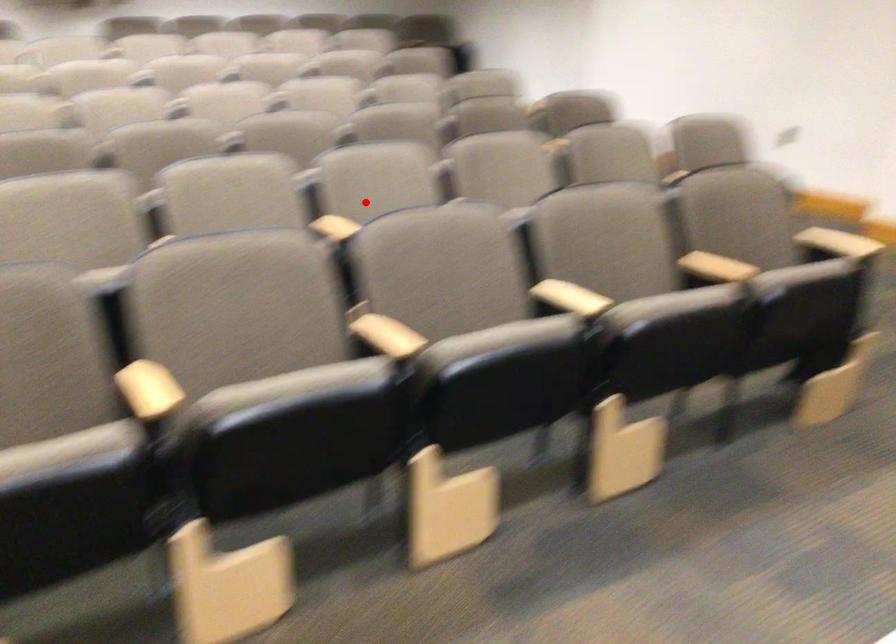
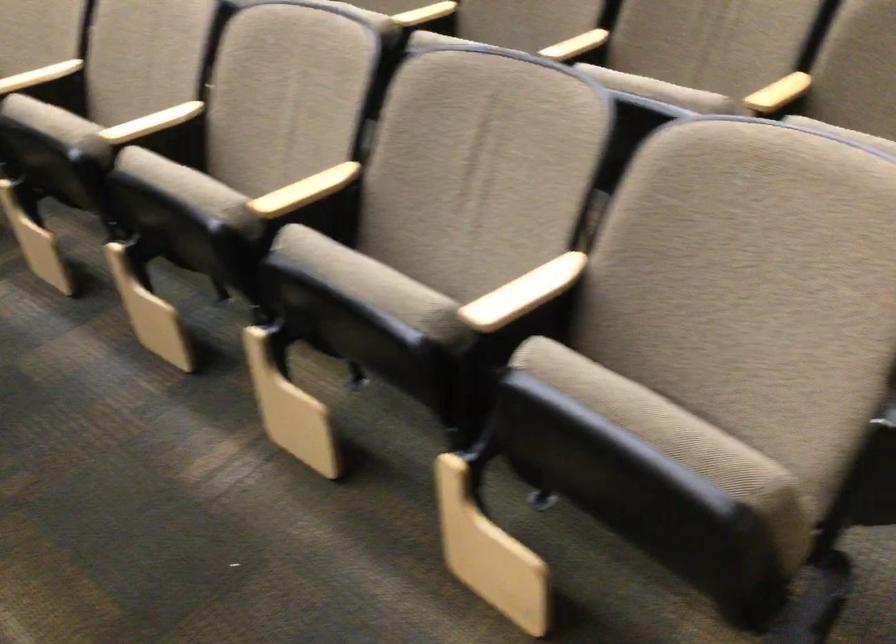
Question: I am providing you with two images of the same scene from different viewpoints. Given a red point in image1, look at the same physical point in image2. Is it:

Choices:
 (A) Closer to the viewpoint
 (B) Farther from the viewpoint

Answer: (A)